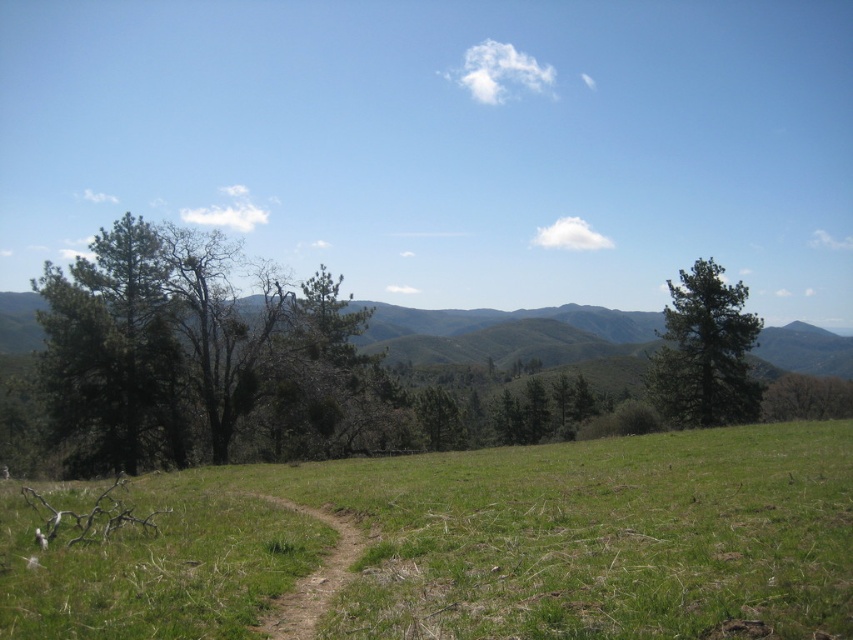
You are standing at the center of the dirt path in the image. Which direction should you walk to reach the green matte tree at left?

You should walk to the left to reach the green matte tree at left, as it is located at point (196,353) which is to the left of the center point.

You are a hiker standing on the green matte tree at left and want to reach the brown dirt path at center. Which direction should you walk to get there?

The brown dirt path at center is behind the green matte tree at left, so you should walk backward to reach it.

You are a hiker standing at the start of the brown dirt path at center and want to reach the green textured mountain at center. Which direction should you walk to get closer to the mountain?

The green textured mountain at center is above the brown dirt path at center, so you should walk forward towards the mountain.